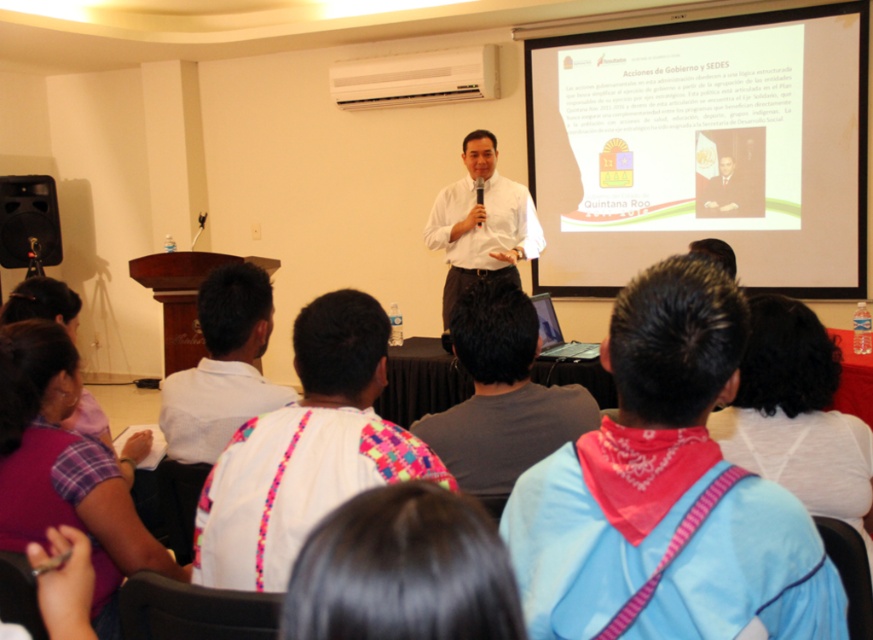
Is pink bandana at center wider than black hair at lower center?

Yes.

Between point (788, 596) and point (495, 620), which one is positioned in front?

Point (495, 620)

Is point (623, 330) behind point (307, 612)?

Yes, point (623, 330) is farther from viewer.

Identify the location of pink bandana at center. The height and width of the screenshot is (640, 873). (667, 492).

Can you confirm if black hair at lower center is shorter than dark suit at center?

Indeed, black hair at lower center has a lesser height compared to dark suit at center.

Locate an element on the screen. Image resolution: width=873 pixels, height=640 pixels. black hair at lower center is located at coordinates (403, 570).

Who is taller, white matte projector screen at upper right or dark suit at center?

white matte projector screen at upper right

Is point (816, 168) more distant than point (746, 195)?

No, (816, 168) is in front of (746, 195).

Where is `white matte projector screen at upper right`? The image size is (873, 640). white matte projector screen at upper right is located at coordinates (703, 147).